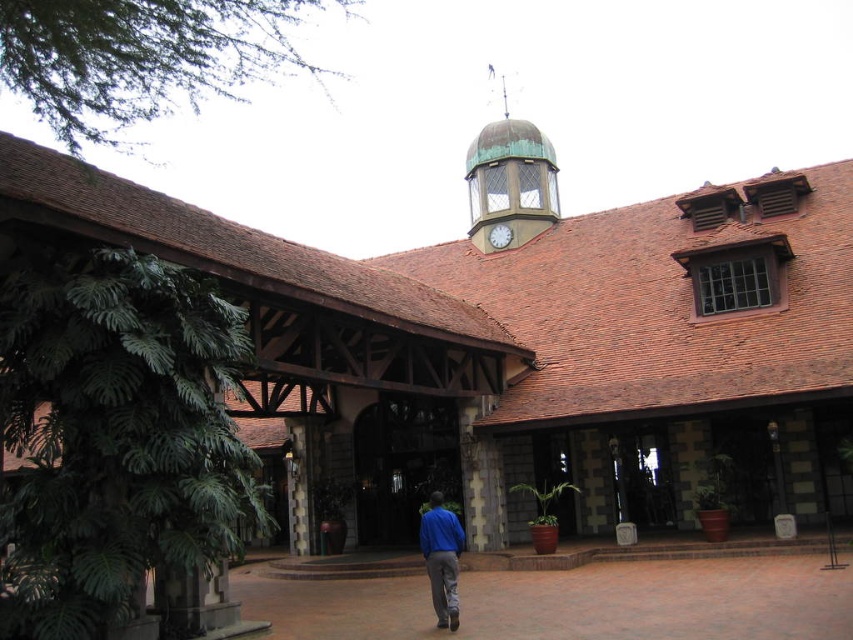
You are standing in front of the building and want to take a photo of the green copper clock tower at upper center and the white glossy clock at center. Which one will appear larger in the photo?

The green copper clock tower at upper center will appear larger in the photo because it is in front of the white glossy clock at center, making it closer to the camera and thus appear bigger.

You are standing in front of the building and want to locate the green copper clock tower at upper center. According to the coordinates provided, where exactly is it positioned?

The green copper clock tower at upper center is located at point coordinates of 0.281 in the x and 0.599 in the y.

You are standing in front of the building and notice both the green copper clock tower at upper center and the blue cotton shirt at center. Which object is closer to you?

The green copper clock tower at upper center is closer to you because the blue cotton shirt at center is behind it.